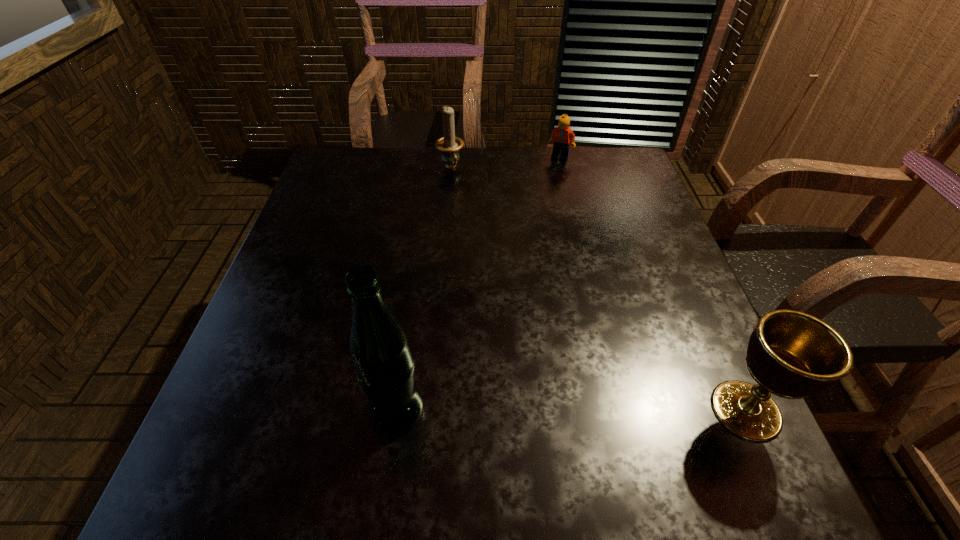
Identify the location of free space at the near edge. The image size is (960, 540). (436, 430).

Identify the location of vacant area at the left edge. This screenshot has width=960, height=540. (332, 333).

This screenshot has height=540, width=960. I want to click on free region at the right edge of the desktop, so click(x=710, y=364).

The image size is (960, 540). What are the coordinates of `vacant space at the far right corner of the desktop` in the screenshot? It's located at (601, 168).

Where is `empty location between the beer bottle and the chalice`? The image size is (960, 540). empty location between the beer bottle and the chalice is located at coordinates (571, 410).

You are a GUI agent. You are given a task and a screenshot of the screen. Output one action in this format:
    pyautogui.click(x=<x>, y=<y>)
    Task: Click on the vacant region between the chalice and the tallest object
    
    Given the screenshot: What is the action you would take?
    (571, 410)

At what (x,y) coordinates should I click in order to perform the action: click on unoccupied area between the candle_holder and the Lego. Please return your answer as a coordinate pair (x, y). This screenshot has width=960, height=540. Looking at the image, I should click on (505, 163).

Where is `empty location between the rightmost object and the shortest object`? Image resolution: width=960 pixels, height=540 pixels. empty location between the rightmost object and the shortest object is located at coordinates click(x=653, y=284).

Identify the location of vacant area between the shortest object and the beer bottle. (478, 284).

Locate an element on the screen. Image resolution: width=960 pixels, height=540 pixels. free space between the chalice and the candle_holder is located at coordinates (598, 289).